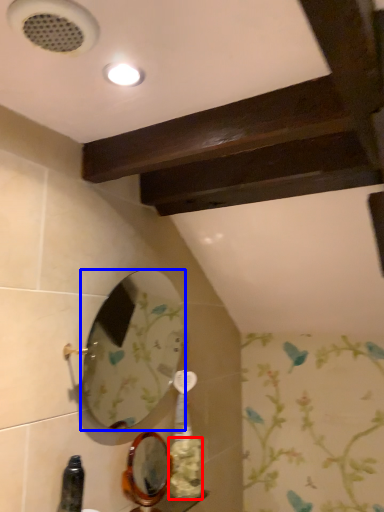
Question: Among these objects, which one is nearest to the camera, flower (highlighted by a red box) or mirror (highlighted by a blue box)?

Choices:
 (A) flower
 (B) mirror

Answer: (B)